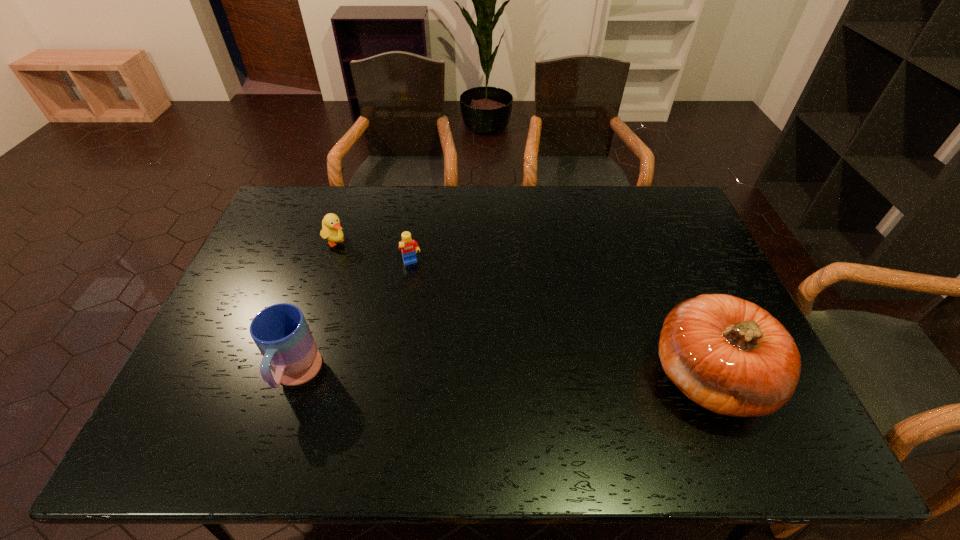
At what (x,y) coordinates should I click in order to perform the action: click on the second tallest object. Please return your answer as a coordinate pair (x, y). The height and width of the screenshot is (540, 960). Looking at the image, I should click on (281, 333).

At what (x,y) coordinates should I click in order to perform the action: click on the rightmost object. Please return your answer as a coordinate pair (x, y). This screenshot has width=960, height=540. Looking at the image, I should click on (730, 356).

Identify the location of the tallest object. This screenshot has width=960, height=540. point(730,356).

Find the location of a particular element. the second farthest object is located at coordinates (409, 247).

I want to click on the second object from right to left, so click(x=409, y=247).

You are a GUI agent. You are given a task and a screenshot of the screen. Output one action in this format:
    pyautogui.click(x=<x>, y=<y>)
    Task: Click on the farthest object
    This screenshot has width=960, height=540.
    Given the screenshot: What is the action you would take?
    pyautogui.click(x=331, y=229)

Identify the location of vacant space located 0.340m on the back of the tallest object. (655, 246).

At what (x,y) coordinates should I click in order to perform the action: click on vacant space located 0.260m on the face of the Lego. Please return your answer as a coordinate pair (x, y). This screenshot has width=960, height=540. Looking at the image, I should click on (441, 334).

The width and height of the screenshot is (960, 540). In order to click on vacant space located on the face of the Lego in this screenshot , I will do `click(456, 370)`.

Find the location of a particular element. free space located on the face of the Lego is located at coordinates (437, 326).